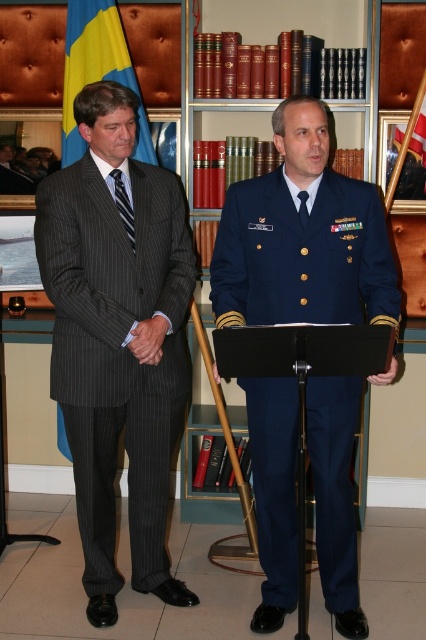
Question: Which of the following is the closest to the observer?

Choices:
 (A) dark gray pinstripe suit at left
 (B) striped fabric tie at left
 (C) navy blue uniform at center
 (D) yellow fabric flag at upper left

Answer: (C)

Question: Which point is closer to the camera taking this photo?

Choices:
 (A) (146, 349)
 (B) (132, 221)

Answer: (A)

Question: Is yellow fabric flag at upper left in front of striped fabric tie at left?

Choices:
 (A) no
 (B) yes

Answer: (A)

Question: Where is matte black suit at left located in relation to striped fabric tie at left in the image?

Choices:
 (A) above
 (B) below

Answer: (A)

Question: Is navy blue uniform at center wider than yellow fabric flag at upper left?

Choices:
 (A) yes
 (B) no

Answer: (A)

Question: Which point is closer to the camera taking this photo?

Choices:
 (A) (88, 10)
 (B) (305, 198)

Answer: (B)